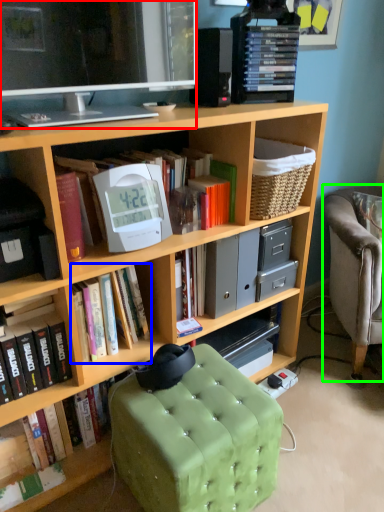
Question: Based on their relative distances, which object is nearer to television (highlighted by a red box)? Choose from book (highlighted by a blue box) and chair (highlighted by a green box).

Choices:
 (A) book
 (B) chair

Answer: (A)